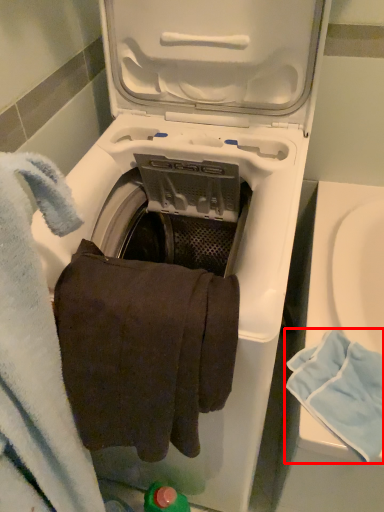
Question: From the image's perspective, where is bath towel (annotated by the red box) located relative to bath towel?

Choices:
 (A) above
 (B) below

Answer: (B)